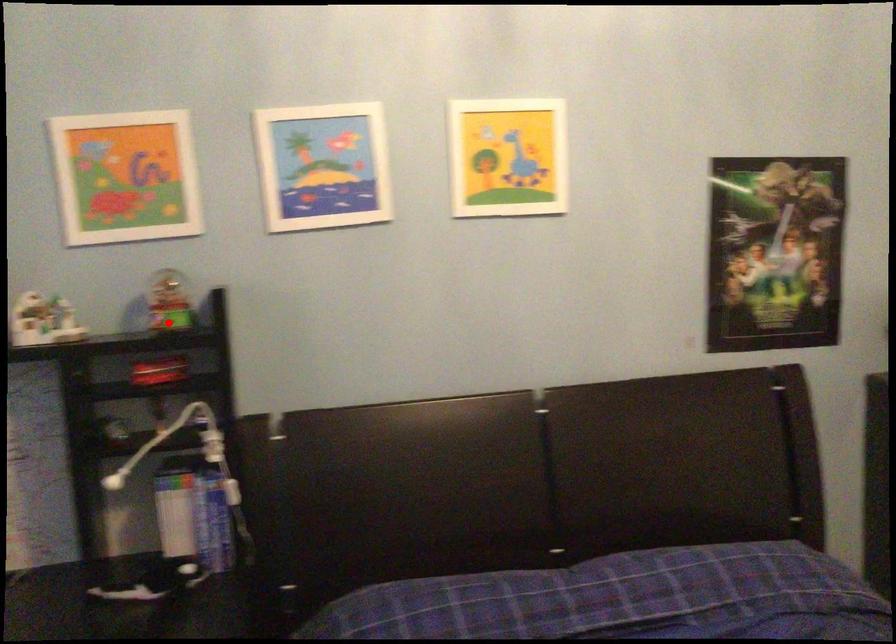
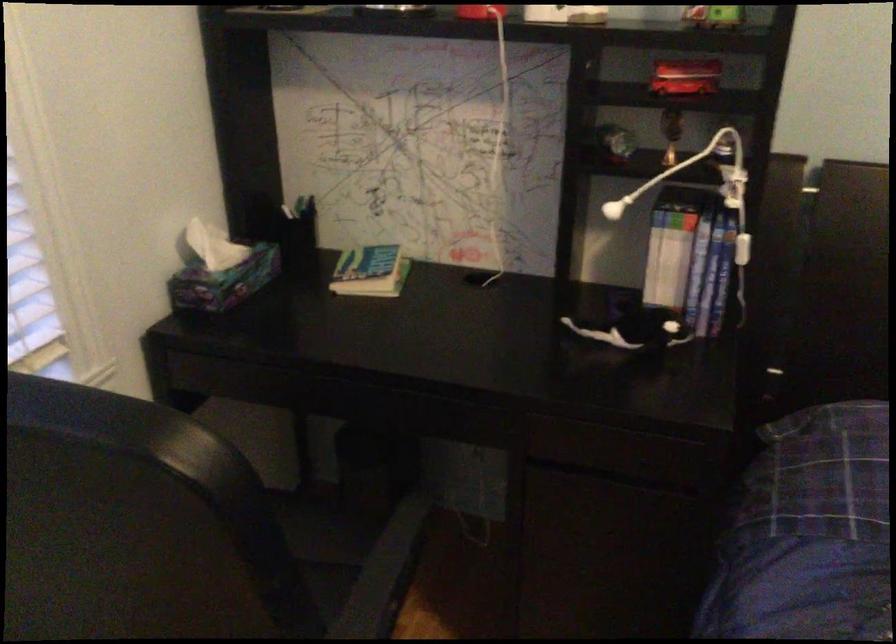
Question: I am providing you with two images of the same scene from different viewpoints. Image1 has a red point marked. In image2, the corresponding 3D location appears at what relative position? Reply with the corresponding letter.

Choices:
 (A) Closer
 (B) Farther

Answer: (A)